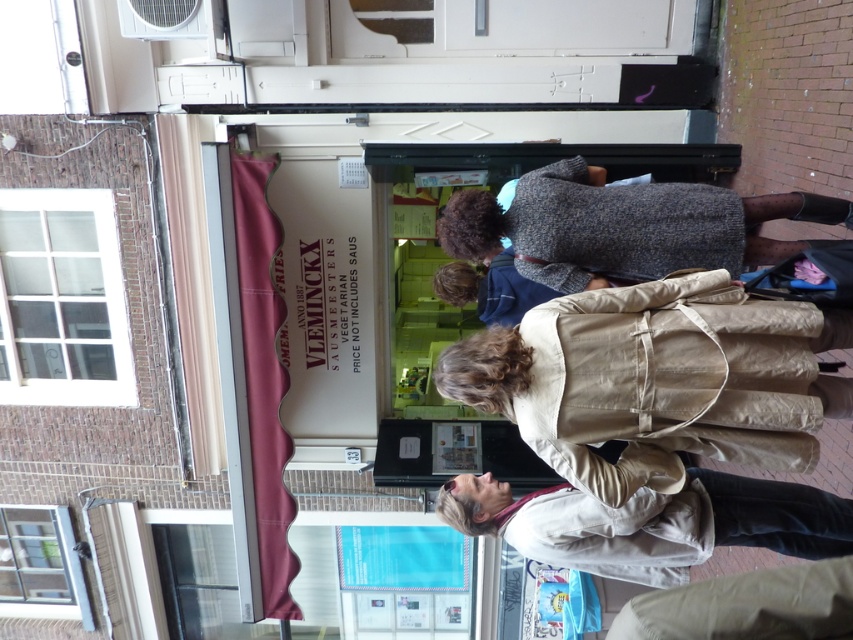
You are a delivery person standing at the entrance of the store. You need to hand a package to the person wearing the knitted sweater at center and the light beige jacket at lower center. Is there enough space between them to walk through?

The distance between the knitted sweater at center and the light beige jacket at lower center is 4.46 feet, so yes, there is enough space to walk through between them.

You are a delivery person standing at the entrance of the store with a package. You need to hand it to the person wearing the beige fabric coat at lower center. The light beige jacket at lower center is in your way. Can you reach the person without moving the jacket?

The distance between the beige fabric coat at lower center and the light beige jacket at lower center is 18.86 inches. Since the light beige jacket at lower center is blocking the path, you would need to move it to reach the beige fabric coat at lower center.

You are standing at the point marked at (654, 429) on the image. The glass door is 10.28 feet away from you. Can you walk straight to the glass door without any obstacles?

Yes, you can walk straight to the glass door because there are no obstacles mentioned between the point marked at (654, 429) and the glass door, and the distance is 10.28 feet.